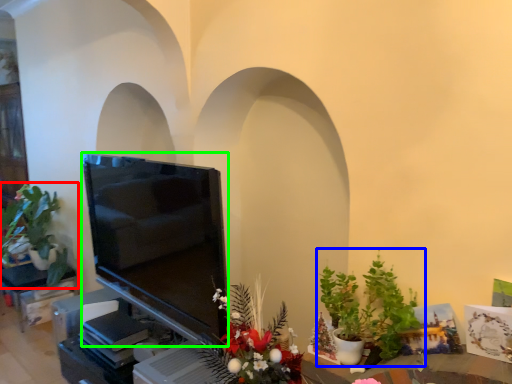
Question: Which object is positioned closest to houseplant (highlighted by a red box)? Select from houseplant (highlighted by a blue box) and television (highlighted by a green box).

Choices:
 (A) houseplant
 (B) television

Answer: (B)